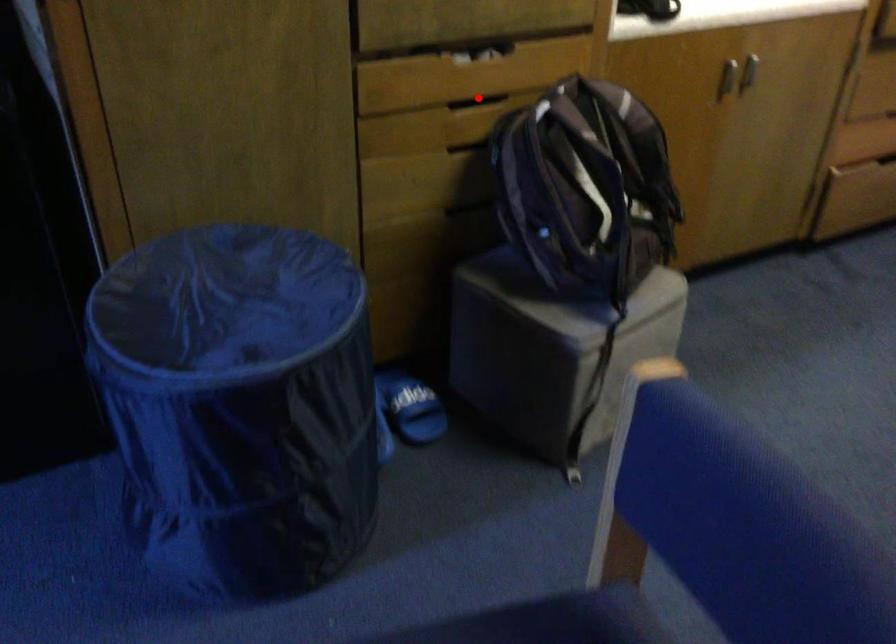
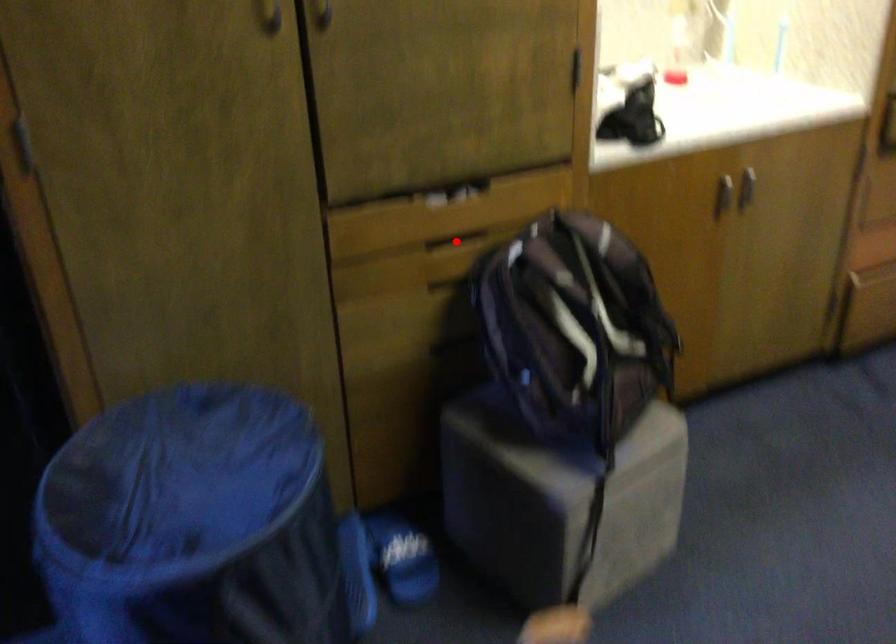
I am providing you with two images of the same scene from different viewpoints. A red point is marked on the first image and another point is marked on the second image. Does the point marked in image1 correspond to the same location as the one in image2?

Yes